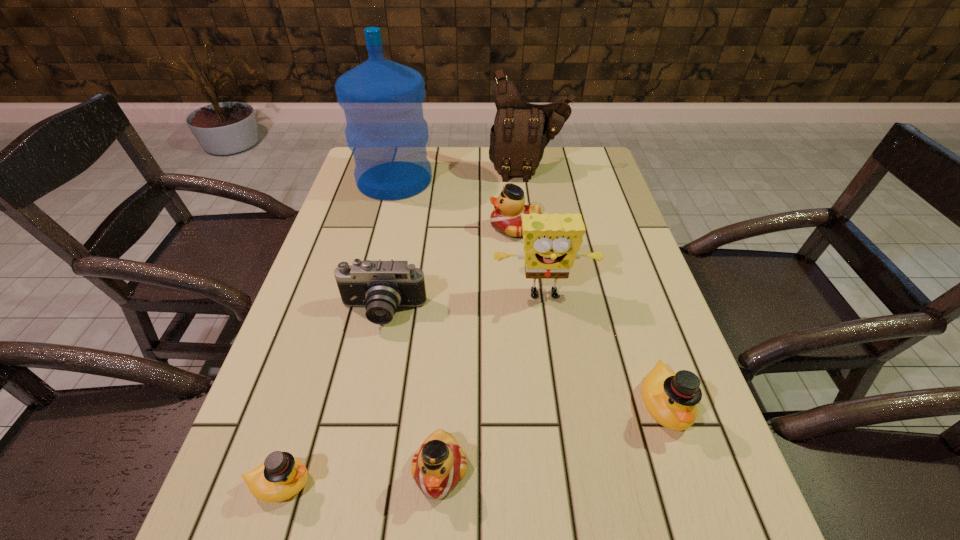
This screenshot has height=540, width=960. I want to click on free space located 0.390m on the face of the sixth nearest object, so click(348, 228).

This screenshot has height=540, width=960. Identify the location of free space located on the front-facing side of the camera. (369, 382).

The image size is (960, 540). Identify the location of free space located on the front-facing side of the farther yellow duck. (690, 482).

Find the location of a particular element. This screenshot has height=540, width=960. vacant space located on the front-facing side of the leftmost duck is located at coordinates (507, 484).

Where is `water jug located at the far edge`? water jug located at the far edge is located at coordinates (382, 100).

Where is `shoulder bag situated at the far edge`? shoulder bag situated at the far edge is located at coordinates (521, 131).

Find the location of `water jug present at the left edge`. water jug present at the left edge is located at coordinates (382, 100).

At what (x,y) coordinates should I click in order to perform the action: click on camera located in the left edge section of the desktop. Please return your answer as a coordinate pair (x, y). The image size is (960, 540). Looking at the image, I should click on (381, 287).

Find the location of a particular element. duck that is at the left edge is located at coordinates (281, 476).

What are the coordinates of `shoulder bag located in the right edge section of the desktop` in the screenshot? It's located at (521, 131).